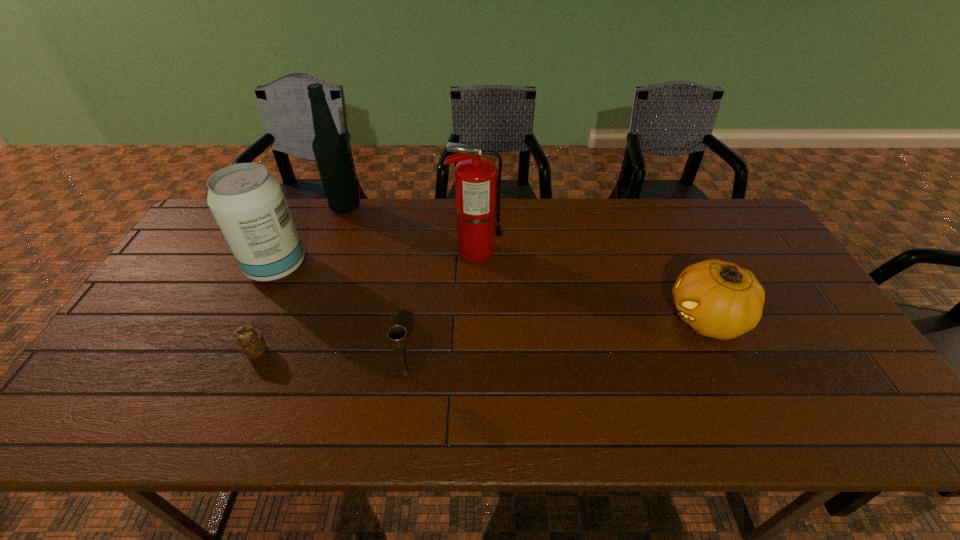
Where is `muffin`? This screenshot has height=540, width=960. muffin is located at coordinates (250, 341).

I want to click on vacant space located on the left of the farthest object, so click(237, 207).

Find the location of a particular element. The image size is (960, 540). free space located at the nozzle of the fire extinguisher is located at coordinates (625, 250).

The image size is (960, 540). Identify the location of vacant space situated on the back of the shorter alcohol. (291, 237).

At what (x,y) coordinates should I click in order to perform the action: click on free point located on the front face of the pumpkin. Please return your answer as a coordinate pair (x, y). The width and height of the screenshot is (960, 540). Looking at the image, I should click on (640, 319).

In order to click on blank space located 0.060m on the front face of the pumpkin in this screenshot , I will do `click(644, 319)`.

Find the location of a particular element. The image size is (960, 540). free location located on the front face of the pumpkin is located at coordinates (542, 319).

Find the location of a particular element. This screenshot has width=960, height=540. vacant space located 0.240m on the right of the fourth object from left to right is located at coordinates (515, 373).

Where is `vacant space located on the left of the shortest object`? vacant space located on the left of the shortest object is located at coordinates (205, 351).

Identify the location of alcohol that is at the far edge. 330,149.